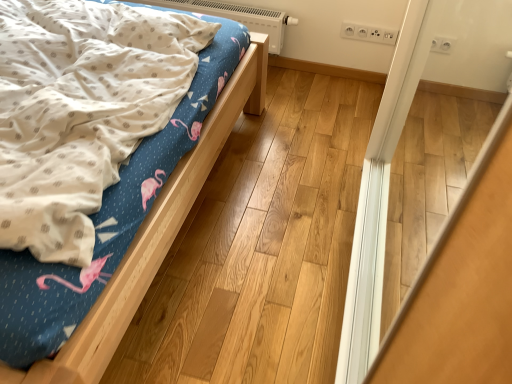
Question: Does white plastic heater at upper center have a smaller size compared to matte wood bed at left?

Choices:
 (A) no
 (B) yes

Answer: (B)

Question: Considering the relative sizes of white plastic heater at upper center and matte wood bed at left in the image provided, is white plastic heater at upper center taller than matte wood bed at left?

Choices:
 (A) yes
 (B) no

Answer: (B)

Question: Considering the relative sizes of white plastic heater at upper center and matte wood bed at left in the image provided, is white plastic heater at upper center bigger than matte wood bed at left?

Choices:
 (A) no
 (B) yes

Answer: (A)

Question: Does white plastic heater at upper center have a lesser height compared to matte wood bed at left?

Choices:
 (A) yes
 (B) no

Answer: (A)

Question: Can you confirm if white plastic heater at upper center is wider than matte wood bed at left?

Choices:
 (A) yes
 (B) no

Answer: (B)

Question: Is white plastic heater at upper center outside matte wood bed at left?

Choices:
 (A) no
 (B) yes

Answer: (B)

Question: Is matte wood bed at left behind white plastic heater at upper center?

Choices:
 (A) no
 (B) yes

Answer: (A)

Question: Is matte wood bed at left far away from white plastic heater at upper center?

Choices:
 (A) no
 (B) yes

Answer: (A)

Question: Is matte wood bed at left not within white plastic heater at upper center?

Choices:
 (A) no
 (B) yes

Answer: (B)

Question: Can you confirm if matte wood bed at left is taller than white plastic heater at upper center?

Choices:
 (A) yes
 (B) no

Answer: (A)

Question: Is matte wood bed at left wider than white plastic heater at upper center?

Choices:
 (A) no
 (B) yes

Answer: (B)

Question: Is matte wood bed at left touching white plastic heater at upper center?

Choices:
 (A) yes
 (B) no

Answer: (B)

Question: From the image's perspective, is white plastic heater at upper center above or below matte wood bed at left?

Choices:
 (A) above
 (B) below

Answer: (A)